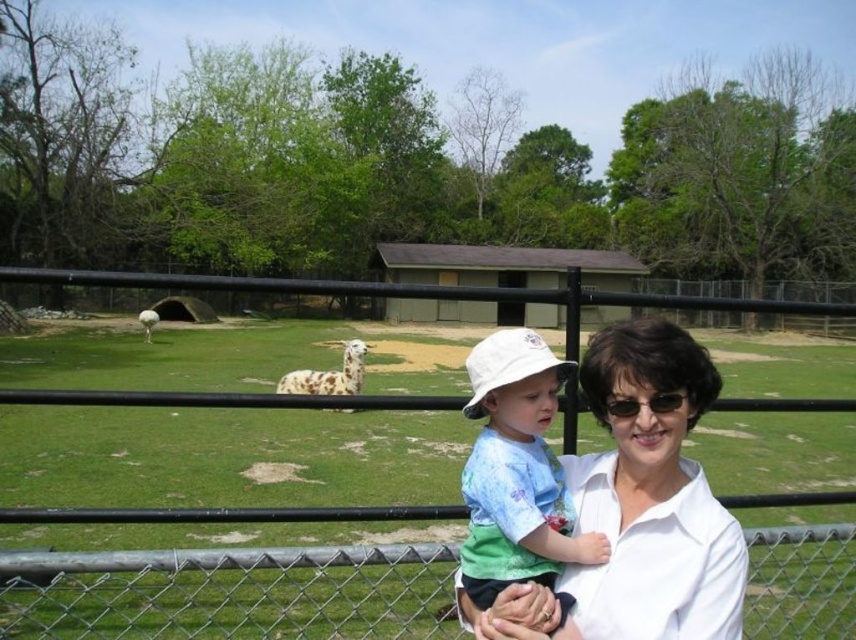
You are a photographer trying to capture a clear shot of the light blue cotton shirt at center and the black plastic sunglasses at center. Which object should you focus on first if you want to ensure both are in focus, considering their sizes?

The light blue cotton shirt at center has a larger size compared to the black plastic sunglasses at center, so focusing on the larger light blue cotton shirt at center first would help ensure both are in focus.

You are a zookeeper trying to determine the exact position of the black metal fence at center in the image. According to the coordinates provided, what are the x and y values of its location?

The 2D location of the black metal fence at center is at point 0.458 in the x coordinate and 0.499 in the y coordinate.

You are a photographer trying to capture a clear shot of the alpacas through the fence. The woman and child are blocking your view. You notice the light blue cotton shirt at center and the black plastic sunglasses at center. Which object would you need to move first to get a better view of the alpacas?

The light blue cotton shirt at center is wider than the black plastic sunglasses at center, so moving the light blue cotton shirt at center first would allow you to get a better view of the alpacas.